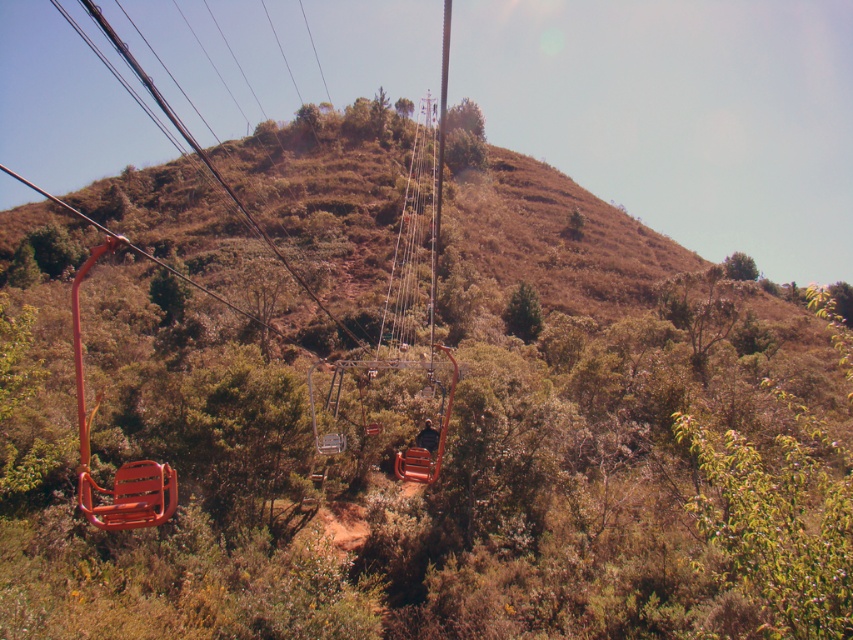
Can you confirm if orange plastic power line at left is smaller than metallic wire at left?

Actually, orange plastic power line at left might be larger than metallic wire at left.

Is orange plastic power line at left positioned in front of metallic wire at left?

No, it is not.

The width and height of the screenshot is (853, 640). Describe the element at coordinates (206, 157) in the screenshot. I see `orange plastic power line at left` at that location.

This screenshot has height=640, width=853. I want to click on orange plastic power line at left, so (x=206, y=157).